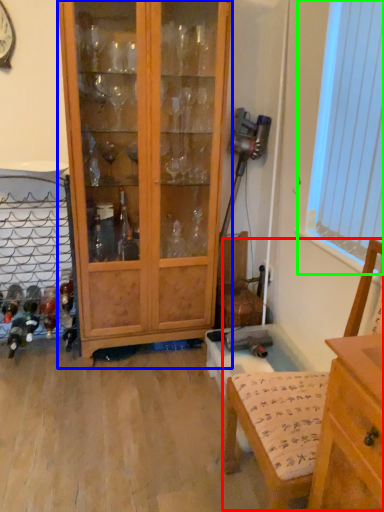
Question: Which object is positioned farthest from armchair (highlighted by a red box)? Select from cabinetry (highlighted by a blue box) and window screen (highlighted by a green box).

Choices:
 (A) cabinetry
 (B) window screen

Answer: (A)